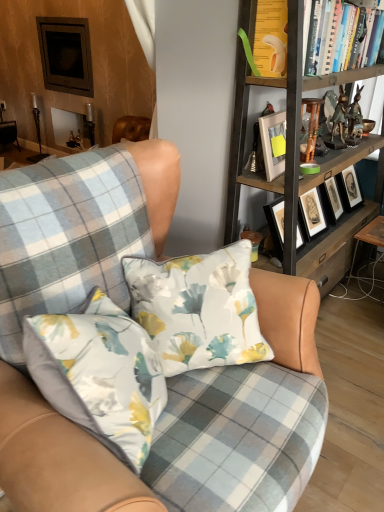
Question: Does floral fabric pillow at center have a larger size compared to plaid fabric chair at center?

Choices:
 (A) no
 (B) yes

Answer: (A)

Question: Does floral fabric pillow at center turn towards plaid fabric chair at center?

Choices:
 (A) no
 (B) yes

Answer: (B)

Question: Is floral fabric pillow at center further to camera compared to plaid fabric chair at center?

Choices:
 (A) no
 (B) yes

Answer: (B)

Question: Can you confirm if floral fabric pillow at center is thinner than plaid fabric chair at center?

Choices:
 (A) no
 (B) yes

Answer: (B)

Question: Is floral fabric pillow at center positioned beyond the bounds of plaid fabric chair at center?

Choices:
 (A) yes
 (B) no

Answer: (B)

Question: From the image's perspective, would you say floral fabric pillow at center is positioned over plaid fabric chair at center?

Choices:
 (A) yes
 (B) no

Answer: (A)

Question: Does hardcover books at upper right have a lesser height compared to white matte picture frame at upper center?

Choices:
 (A) no
 (B) yes

Answer: (A)

Question: Is hardcover books at upper right at the right side of white matte picture frame at upper center?

Choices:
 (A) no
 (B) yes

Answer: (B)

Question: Is hardcover books at upper right closer to the viewer compared to white matte picture frame at upper center?

Choices:
 (A) yes
 (B) no

Answer: (B)

Question: Is hardcover books at upper right aimed at white matte picture frame at upper center?

Choices:
 (A) yes
 (B) no

Answer: (B)

Question: From the image's perspective, is hardcover books at upper right above white matte picture frame at upper center?

Choices:
 (A) no
 (B) yes

Answer: (B)

Question: Considering the relative sizes of hardcover books at upper right and white matte picture frame at upper center in the image provided, is hardcover books at upper right thinner than white matte picture frame at upper center?

Choices:
 (A) no
 (B) yes

Answer: (A)

Question: From the image's perspective, is floral fabric pillow at center over hardcover books at upper right?

Choices:
 (A) yes
 (B) no

Answer: (B)